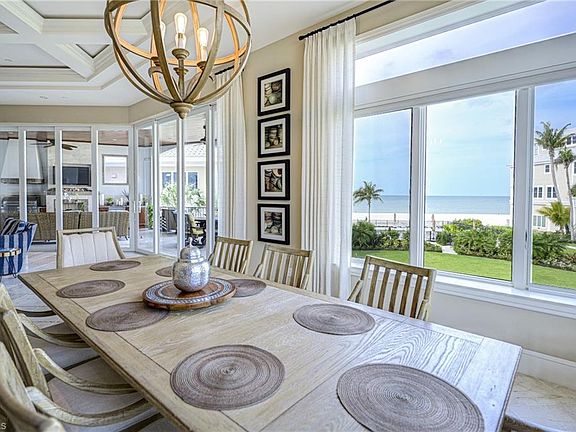
This screenshot has width=576, height=432. I want to click on beams, so click(x=64, y=42).